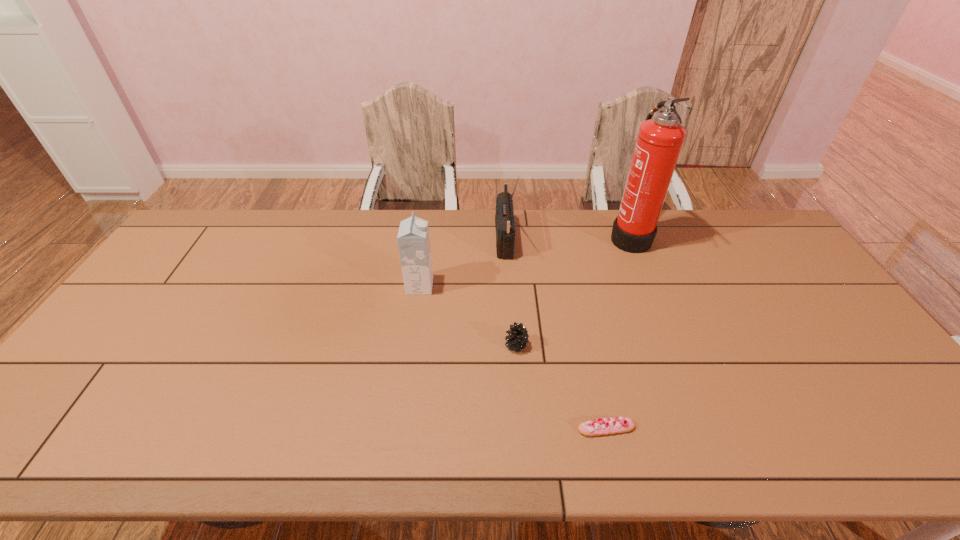
Identify the location of free space located 0.150m on the front-facing side of the fire extinguisher. (565, 236).

Where is `vacant space located 0.050m on the front-facing side of the fire extinguisher`? vacant space located 0.050m on the front-facing side of the fire extinguisher is located at coordinates (594, 236).

Find the location of a particular element. The image size is (960, 540). vacant region located on the front-facing side of the radio receiver is located at coordinates (394, 241).

Locate an element on the screen. Image resolution: width=960 pixels, height=540 pixels. vacant region located on the front-facing side of the radio receiver is located at coordinates (449, 241).

This screenshot has height=540, width=960. Identify the location of vacant space located 0.070m on the front-facing side of the radio receiver. (475, 241).

This screenshot has width=960, height=540. In order to click on vacant area situated 0.180m on the front label of the third tallest object in this screenshot , I will do `click(492, 286)`.

Locate an element on the screen. The width and height of the screenshot is (960, 540). free space located on the right of the second shortest object is located at coordinates (629, 345).

Where is `free spot located on the left of the shortest object`? free spot located on the left of the shortest object is located at coordinates (529, 428).

This screenshot has width=960, height=540. In order to click on fire extinguisher that is at the far edge in this screenshot , I will do `click(659, 142)`.

Find the location of a particular element. radio receiver situated at the far edge is located at coordinates (504, 219).